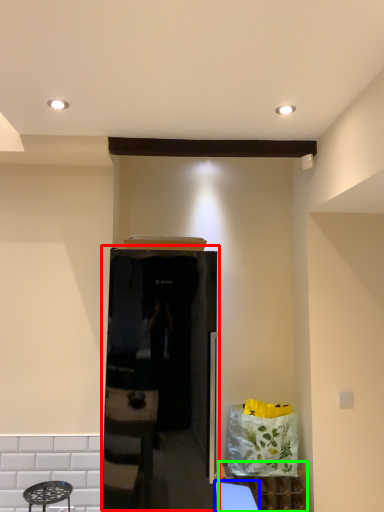
Question: Which object is the closest to the appliance (highlighted by a red box)? Choose among these: table (highlighted by a blue box) or cabinetry (highlighted by a green box).

Choices:
 (A) table
 (B) cabinetry

Answer: (A)